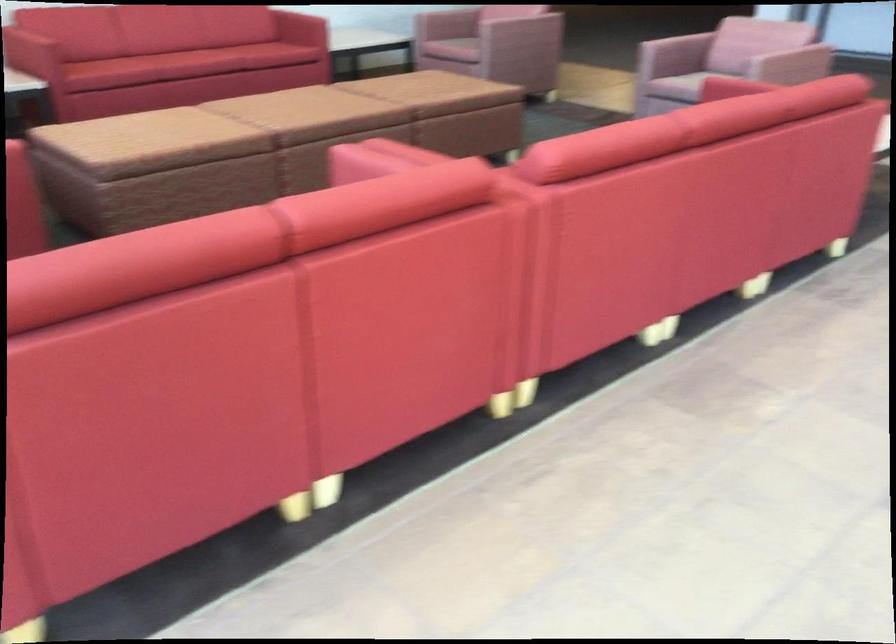
Find where to sit the sofa sitting surface. Please return your answer as a coordinate pair (x, y).

(207, 52)